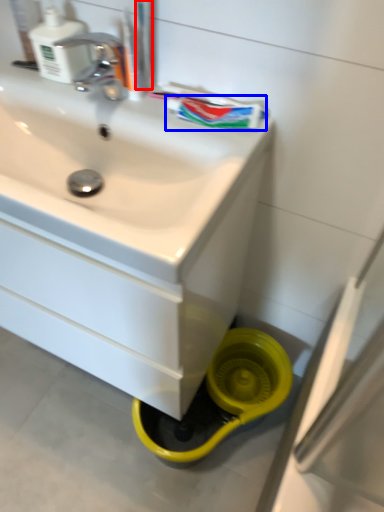
Question: Which point is closer to the camera, toothbrush (highlighted by a red box) or toothpaste (highlighted by a blue box)?

Choices:
 (A) toothbrush
 (B) toothpaste

Answer: (A)